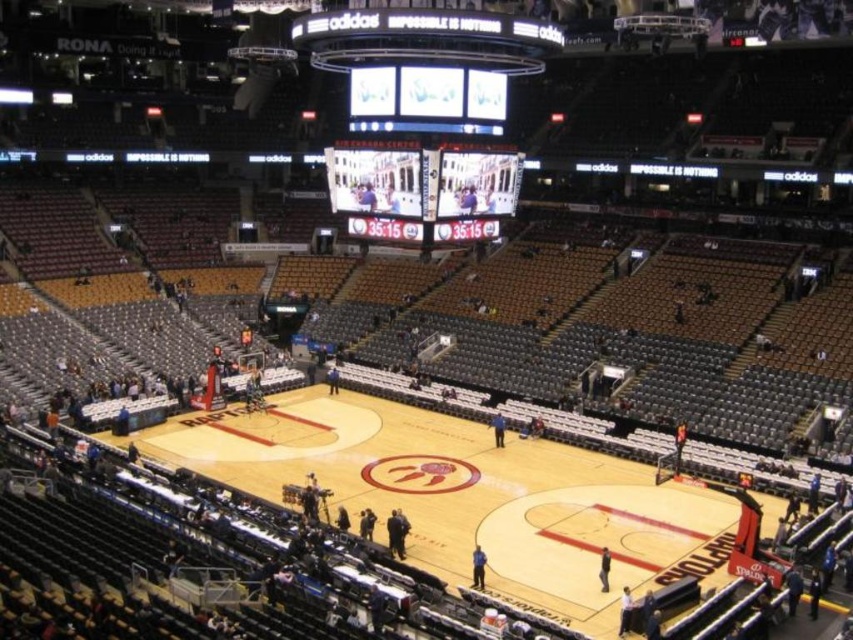
Question: Observing the image, what is the correct spatial positioning of wooden basketball court at center in reference to led display at center?

Choices:
 (A) above
 (B) below

Answer: (B)

Question: Which point is farther to the camera?

Choices:
 (A) wooden basketball court at center
 (B) led display at center

Answer: (B)

Question: Is wooden basketball court at center to the left of led display at center from the viewer's perspective?

Choices:
 (A) yes
 (B) no

Answer: (A)

Question: Does wooden basketball court at center appear over led display at center?

Choices:
 (A) yes
 (B) no

Answer: (B)